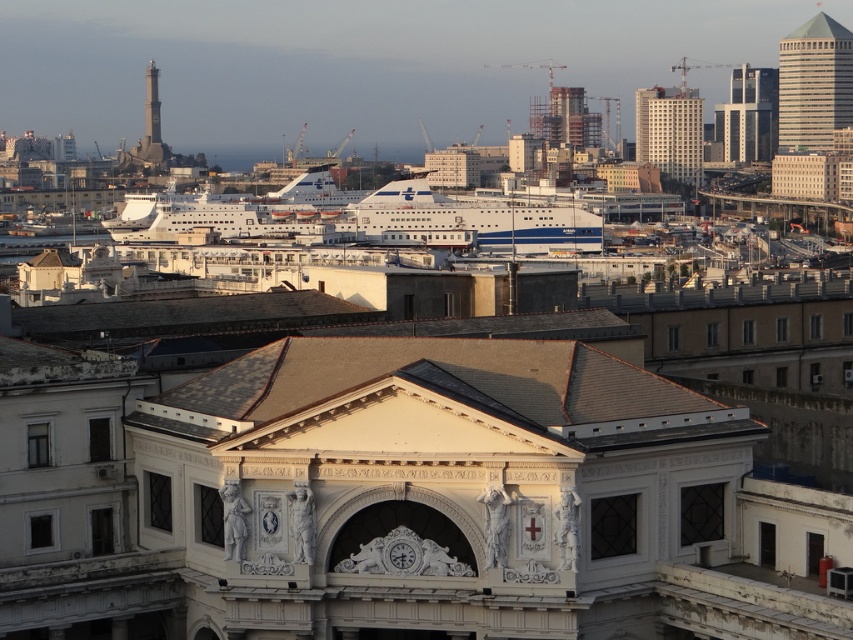
Question: Among these objects, which one is farthest from the camera?

Choices:
 (A) gray stone lighthouse at upper left
 (B) white smooth building at upper right
 (C) glassy white skyscraper at upper right
 (D) smooth gray tower at upper left

Answer: (D)

Question: Considering the real-world distances, which object is farthest from the white glossy cruise ship at center?

Choices:
 (A) gray stone lighthouse at upper left
 (B) smooth gray tower at upper left
 (C) glassy white skyscraper at upper right

Answer: (B)

Question: In this image, where is white glossy cruise ship at center located relative to smooth gray tower at upper left?

Choices:
 (A) left
 (B) right

Answer: (B)

Question: Is white glossy cruise ship at center to the left of white smooth building at upper right from the viewer's perspective?

Choices:
 (A) no
 (B) yes

Answer: (B)

Question: Where is glassy white skyscraper at upper right located in relation to gray stone lighthouse at upper left in the image?

Choices:
 (A) above
 (B) below

Answer: (A)

Question: Which object is closer to the camera taking this photo?

Choices:
 (A) smooth gray tower at upper left
 (B) glassy white skyscraper at upper right

Answer: (B)